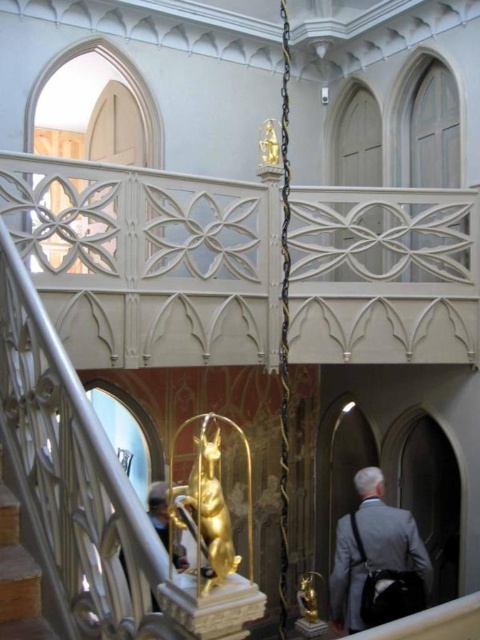
Question: Can you confirm if gray fabric coat at lower right is positioned above gold polished statue at center?

Choices:
 (A) yes
 (B) no

Answer: (A)

Question: Can you confirm if gold polished statue at center is thinner than wooden at lower left?

Choices:
 (A) no
 (B) yes

Answer: (B)

Question: Which of these objects is positioned closest to the gray fabric coat at lower right?

Choices:
 (A) wooden at lower left
 (B) gold polished statue at center

Answer: (B)

Question: Which object is farther from the camera taking this photo?

Choices:
 (A) gray fabric coat at lower right
 (B) gold polished statue at center
 (C) wooden at lower left

Answer: (B)

Question: Can you confirm if gold polished statue at center is wider than wooden at lower left?

Choices:
 (A) yes
 (B) no

Answer: (B)

Question: Which point is closer to the camera?

Choices:
 (A) gray fabric coat at lower right
 (B) gold polished statue at center

Answer: (A)